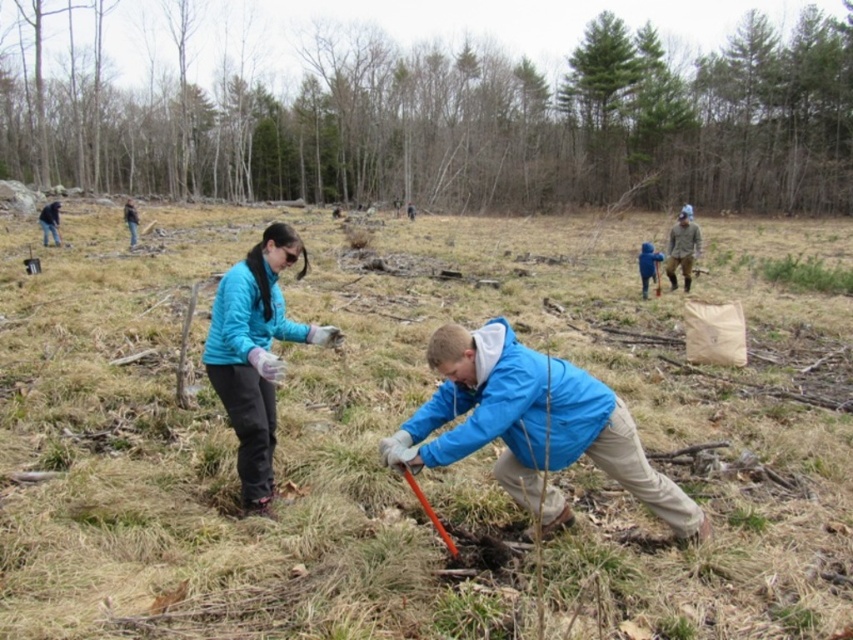
You are organizing a community cleanup and need to know which volunteer has more space in their backpack. The volunteers are wearing the blue fleece jacket at center and the dark blue jacket at upper left. Based on the image, which volunteer has a larger backpack?

The dark blue jacket at upper left has a larger backpack because the blue fleece jacket at center occupies less space than dark blue jacket at upper left.

You are a hiker who wants to take a photo of the green leafy tree at upper center. You are currently standing near the blue fabric jacket at center. Can you see the entire tree without any obstruction?

The green leafy tree at upper center is much taller than the blue fabric jacket at center, so you might not be able to see the entire tree from your current position near the blue fabric jacket at center because the tree is significantly taller and could be partially obstructed by its own branches or the surrounding environment.